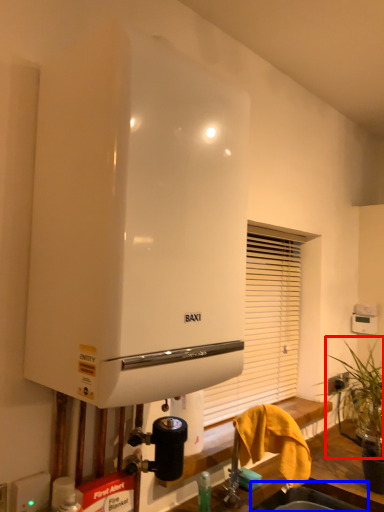
Question: Among these objects, which one is farthest to the camera, plant (highlighted by a red box) or sink (highlighted by a blue box)?

Choices:
 (A) plant
 (B) sink

Answer: (A)